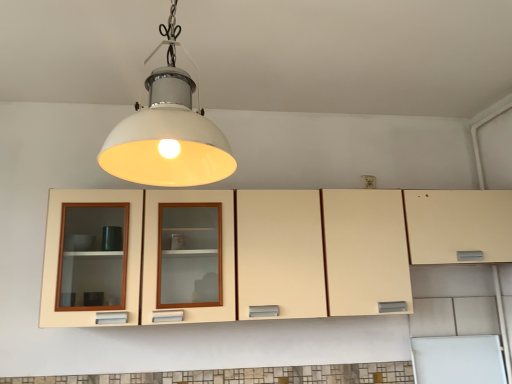
Describe the element at coordinates (275, 251) in the screenshot. The image size is (512, 384). I see `matte cream cabinet at center` at that location.

The width and height of the screenshot is (512, 384). What are the coordinates of `matte cream cabinet at center` in the screenshot? It's located at (275, 251).

The width and height of the screenshot is (512, 384). Describe the element at coordinates (168, 131) in the screenshot. I see `white matte lampshade at center` at that location.

Where is `white matte lampshade at center`? white matte lampshade at center is located at coordinates (168, 131).

Measure the distance between white matte lampshade at center and camera.

white matte lampshade at center is 3.38 feet away from camera.

At what (x,y) coordinates should I click in order to perform the action: click on matte cream cabinet at center. Please return your answer as a coordinate pair (x, y). Image resolution: width=512 pixels, height=384 pixels. Looking at the image, I should click on (275, 251).

Can you confirm if matte cream cabinet at center is positioned to the right of white matte lampshade at center?

Indeed, matte cream cabinet at center is positioned on the right side of white matte lampshade at center.

Considering the positions of objects matte cream cabinet at center and white matte lampshade at center in the image provided, who is in front, matte cream cabinet at center or white matte lampshade at center?

white matte lampshade at center is more forward.

Considering the points (158, 315) and (220, 151), which point is in front, point (158, 315) or point (220, 151)?

The point (220, 151) is closer to the camera.

From the image's perspective, is matte cream cabinet at center located above or below white matte lampshade at center?

Based on their image positions, matte cream cabinet at center is located beneath white matte lampshade at center.

From a real-world perspective, which is physically below, matte cream cabinet at center or white matte lampshade at center?

In real-world perspective, matte cream cabinet at center is lower.

Considering the sizes of matte cream cabinet at center and white matte lampshade at center in the image, is matte cream cabinet at center wider or thinner than white matte lampshade at center?

matte cream cabinet at center is thinner than white matte lampshade at center.

Does matte cream cabinet at center have a lesser height compared to white matte lampshade at center?

Yes.

Is matte cream cabinet at center smaller than white matte lampshade at center?

Incorrect, matte cream cabinet at center is not smaller in size than white matte lampshade at center.

Would you say matte cream cabinet at center is outside white matte lampshade at center?

Yes, matte cream cabinet at center is not within white matte lampshade at center.

Is matte cream cabinet at center touching white matte lampshade at center?

No, matte cream cabinet at center is not touching white matte lampshade at center.

Is matte cream cabinet at center looking in the opposite direction of white matte lampshade at center?

No, matte cream cabinet at center is not facing away from white matte lampshade at center.

Can you tell me how much matte cream cabinet at center and white matte lampshade at center differ in facing direction?

matte cream cabinet at center and white matte lampshade at center are facing 90 degrees away from each other.

Identify the location of lamp above the matte cream cabinet at center (from the image's perspective). (168, 131).

Which is more to the left, white matte lampshade at center or matte cream cabinet at center?

From the viewer's perspective, white matte lampshade at center appears more on the left side.

Considering the relative positions of white matte lampshade at center and matte cream cabinet at center in the image provided, is white matte lampshade at center behind matte cream cabinet at center?

That is False.

Between point (146, 183) and point (317, 195), which one is positioned behind?

Point (317, 195)

From the image's perspective, is white matte lampshade at center over matte cream cabinet at center?

Yes, from the image's perspective, white matte lampshade at center is over matte cream cabinet at center.

From a real-world perspective, is white matte lampshade at center under matte cream cabinet at center?

No, from a real-world perspective, white matte lampshade at center is not under matte cream cabinet at center.

Considering the sizes of white matte lampshade at center and matte cream cabinet at center in the image, is white matte lampshade at center wider or thinner than matte cream cabinet at center?

In the image, white matte lampshade at center appears to be wider than matte cream cabinet at center.

Between white matte lampshade at center and matte cream cabinet at center, which one has more height?

With more height is white matte lampshade at center.

Which of these two, white matte lampshade at center or matte cream cabinet at center, is bigger?

Bigger between the two is matte cream cabinet at center.

Is matte cream cabinet at center located within white matte lampshade at center?

No, matte cream cabinet at center is located outside of white matte lampshade at center.

Are white matte lampshade at center and matte cream cabinet at center beside each other?

There is a gap between white matte lampshade at center and matte cream cabinet at center.

Could you tell me if white matte lampshade at center is turned towards matte cream cabinet at center?

No, white matte lampshade at center is not turned towards matte cream cabinet at center.

How different are the orientations of white matte lampshade at center and matte cream cabinet at center in degrees?

The angle between the facing direction of white matte lampshade at center and the facing direction of matte cream cabinet at center is 90 degrees.

Find the location of a particular element. This screenshot has height=384, width=512. lamp in front of the matte cream cabinet at center is located at coordinates (168, 131).

This screenshot has height=384, width=512. I want to click on cabinetry behind the white matte lampshade at center, so click(x=275, y=251).

Find the location of a particular element. This screenshot has height=384, width=512. lamp in front of the matte cream cabinet at center is located at coordinates (168, 131).